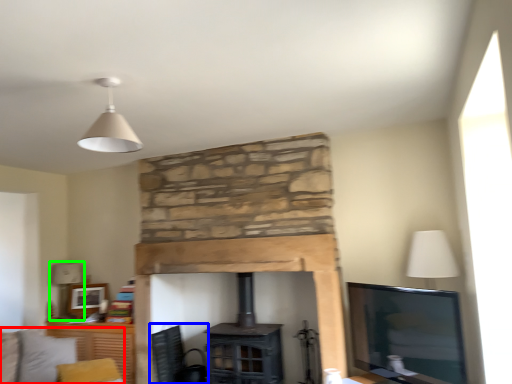
Question: Based on their relative distances, which object is nearer to couch (highlighted by a red box)? Choose from swivel chair (highlighted by a blue box) and table lamp (highlighted by a green box).

Choices:
 (A) swivel chair
 (B) table lamp

Answer: (B)